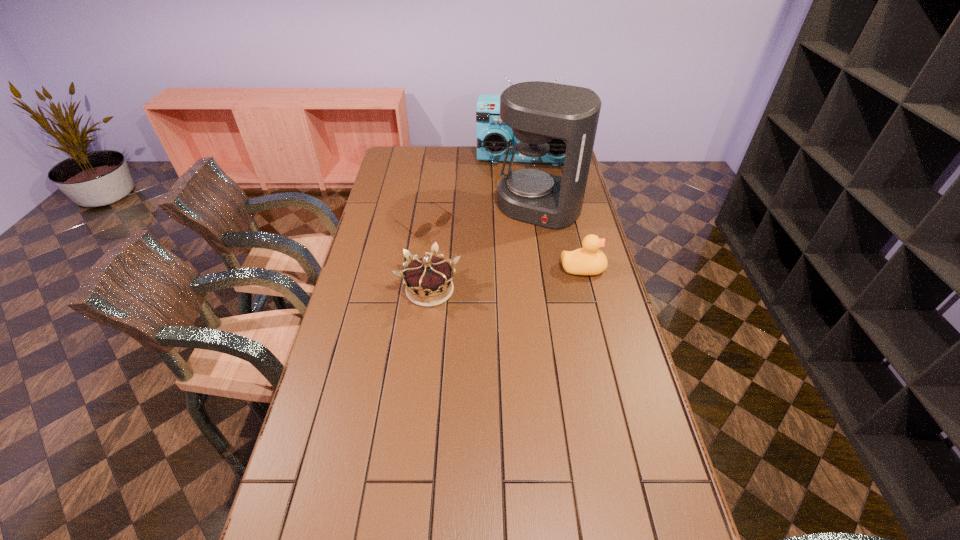
Find the location of a particular element. The image size is (960, 540). coffee maker situated at the right edge is located at coordinates (537, 112).

What are the coordinates of `object at the far right corner` in the screenshot? It's located at (494, 137).

I want to click on free space at the far edge, so click(x=476, y=146).

Where is `blank space at the near edge`? This screenshot has width=960, height=540. blank space at the near edge is located at coordinates pos(496,503).

The height and width of the screenshot is (540, 960). What are the coordinates of `free spot at the left edge of the desktop` in the screenshot? It's located at (361, 419).

I want to click on vacant space at the right edge of the desktop, so click(608, 279).

In the image, there is a desktop. Where is `vacant space at the far left corner`? Image resolution: width=960 pixels, height=540 pixels. vacant space at the far left corner is located at coordinates (420, 163).

I want to click on free region at the near left corner of the desktop, so click(x=311, y=521).

I want to click on free space that is in between the duck and the crown, so [506, 279].

In order to click on vacant area that lies between the sunglasses and the tallest object in this screenshot , I will do `click(482, 215)`.